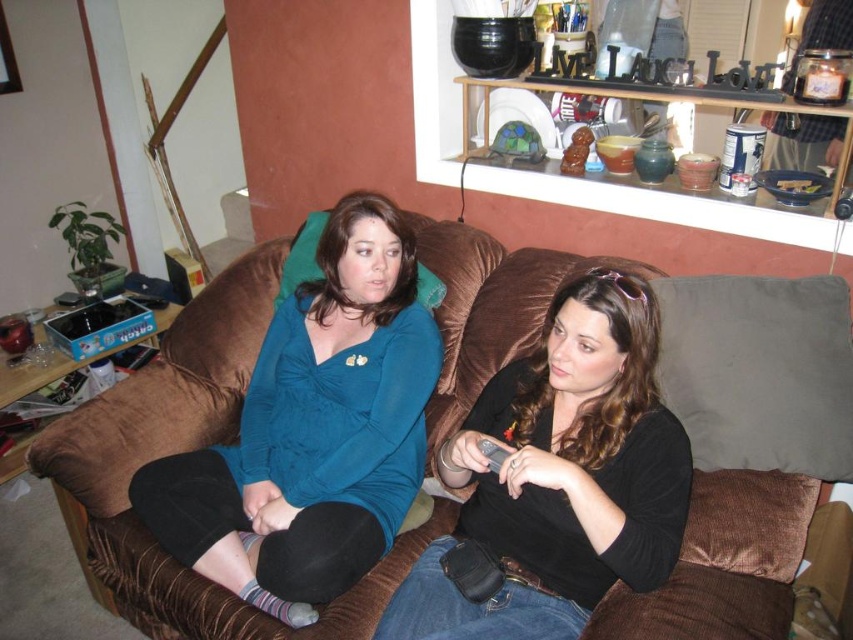
Who is positioned more to the right, brown corduroy couch at center or black plastic remote at center?

black plastic remote at center is more to the right.

Who is higher up, brown corduroy couch at center or black plastic remote at center?

brown corduroy couch at center is above.

At what (x,y) coordinates should I click in order to perform the action: click on brown corduroy couch at center. Please return your answer as a coordinate pair (x, y). This screenshot has width=853, height=640. Looking at the image, I should click on (189, 449).

Can you confirm if teal fabric shirt at center is bigger than black matte shirt at center?

Yes.

Looking at this image, is the position of teal fabric shirt at center less distant than that of black matte shirt at center?

No, it is behind black matte shirt at center.

I want to click on teal fabric shirt at center, so click(x=312, y=429).

At what (x,y) coordinates should I click in order to perform the action: click on teal fabric shirt at center. Please return your answer as a coordinate pair (x, y). The width and height of the screenshot is (853, 640). Looking at the image, I should click on (312, 429).

Does brown corduroy couch at center lie in front of teal fabric shirt at center?

No, it is not.

Between point (39, 451) and point (277, 428), which one is positioned behind?

The point (277, 428) is more distant.

Identify the location of brown corduroy couch at center. The height and width of the screenshot is (640, 853). (189, 449).